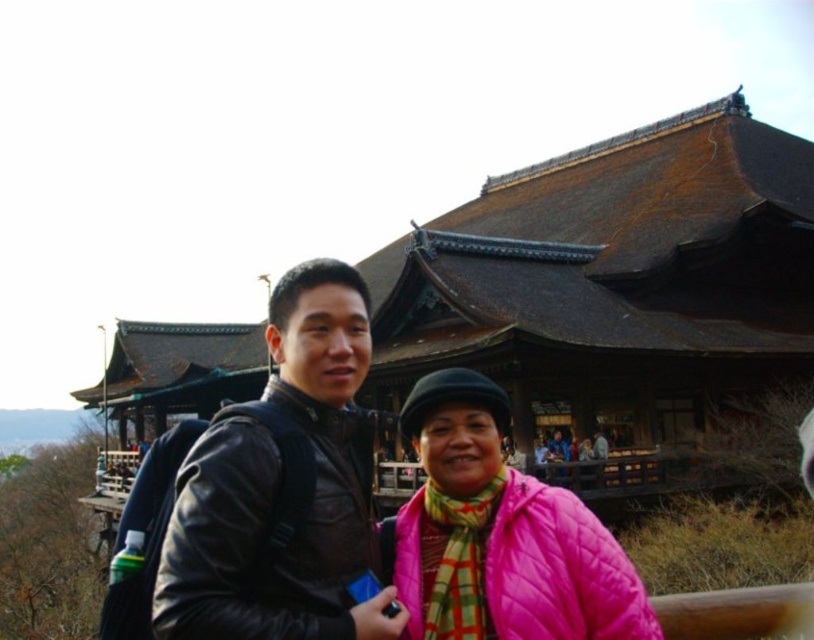
You are standing in front of a traditional Japanese building and see a person wearing a leather jacket at center and a brown wooden palace at center. Which object is positioned to the left?

The brown wooden palace at center is to the left of the leather jacket at center.

You are a photographer standing at the camera position. You want to place a small flag at point (320, 401) which is 36.33 meters away from you. However, you have a flag that can only be placed up to 30 meters away. Can you place the flag there?

The distance of point (320, 401) from camera is 36.33 meters, so the flag cannot be placed there as it exceeds the maximum range of 30 meters.